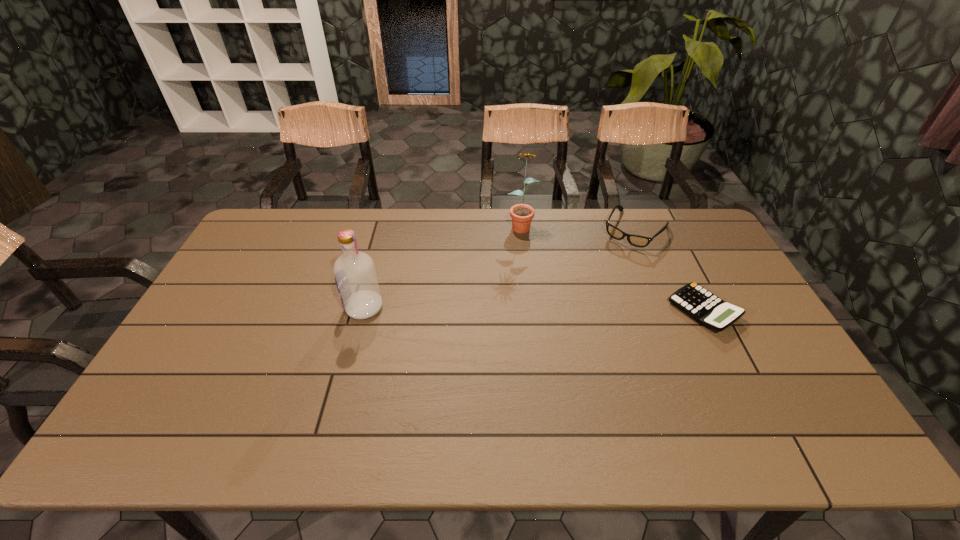
Where is `free area in between the third object from right to left and the shortest object`? free area in between the third object from right to left and the shortest object is located at coordinates (612, 267).

Locate an element on the screen. The height and width of the screenshot is (540, 960). unoccupied area between the leftmost object and the sunflower is located at coordinates (443, 266).

At what (x,y) coordinates should I click in order to perform the action: click on empty space between the shortest object and the spectacles. Please return your answer as a coordinate pair (x, y). Image resolution: width=960 pixels, height=540 pixels. Looking at the image, I should click on (669, 270).

I want to click on vacant region between the vodka and the calculator, so click(x=534, y=309).

Identify which object is the nearest to the vodka. Please provide its 2D coordinates. Your answer should be formatted as a tuple, i.e. [(x, y)], where the tuple contains the x and y coordinates of a point satisfying the conditions above.

[(522, 214)]

The width and height of the screenshot is (960, 540). Find the location of `object that is the second closest to the calculator`. object that is the second closest to the calculator is located at coordinates (522, 214).

Identify the location of free region that satisfies the following two spatial constraints: 1. on the front side of the third object from right to left; 2. on the right side of the calculator. Image resolution: width=960 pixels, height=540 pixels. (531, 310).